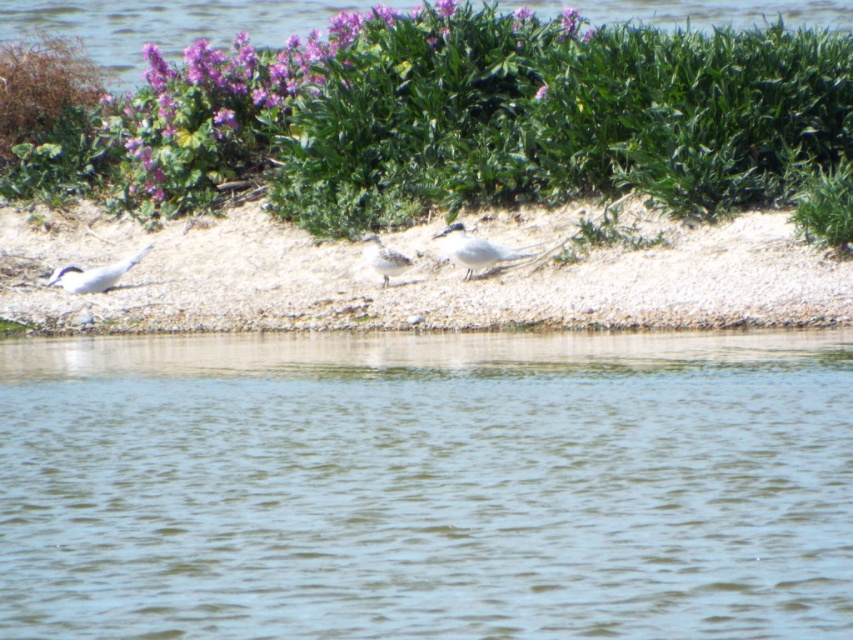
You are a photographer planning to capture the green leafy shrubs at upper center and the clear water at upper center in a single shot. Based on their widths, which object should you focus on to ensure both are in frame without needing to adjust your camera angle?

The green leafy shrubs at upper center has a smaller width than the clear water at upper center. To ensure both are in frame, focus on the clear water at upper center since it occupies more space, allowing the narrower green leafy shrubs at upper center to fit within the same shot.

You are a drone operator flying a drone over the serene natural scene. The drone is currently at the center of the image. You need to adjust the drone to hover directly above the green leafy shrubs at upper center. Which direction should you move the drone to reach the shrubs?

The green leafy shrubs at upper center are located at coordinates 0.186 on the x axis and 0.597 on the y axis. Since the drone is at the center of the image, which is at coordinates 0.5 on both axes, you should move the drone to the left and down to reach the shrubs.